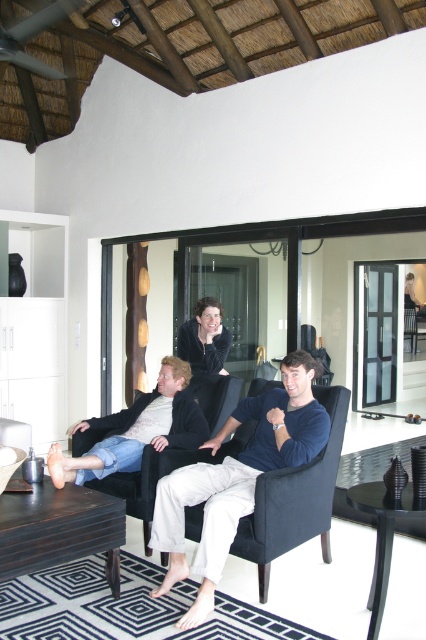
Does light beige cotton pants at center have a lesser width compared to dark blue fabric armchair at center?

Indeed, light beige cotton pants at center has a lesser width compared to dark blue fabric armchair at center.

From the picture: Between light beige cotton pants at center and dark blue fabric armchair at center, which one appears on the right side from the viewer's perspective?

Positioned to the right is light beige cotton pants at center.

The image size is (426, 640). What are the coordinates of `light beige cotton pants at center` in the screenshot? It's located at (236, 477).

I want to click on light beige cotton pants at center, so pyautogui.click(x=236, y=477).

This screenshot has width=426, height=640. What do you see at coordinates (137, 429) in the screenshot?
I see `denim jeans at left` at bounding box center [137, 429].

Between denim jeans at left and matte black jacket at center, which one is positioned higher?

matte black jacket at center is higher up.

You are a GUI agent. You are given a task and a screenshot of the screen. Output one action in this format:
    pyautogui.click(x=<x>, y=<y>)
    Task: Click on the denim jeans at left
    
    Given the screenshot: What is the action you would take?
    pyautogui.click(x=137, y=429)

Image resolution: width=426 pixels, height=640 pixels. What are the coordinates of `denim jeans at left` in the screenshot? It's located at (137, 429).

Measure the distance between denim jeans at left and camera.

denim jeans at left is 3.26 meters from camera.

At what (x,y) coordinates should I click in order to perform the action: click on denim jeans at left. Please return your answer as a coordinate pair (x, y). The width and height of the screenshot is (426, 640). Looking at the image, I should click on (137, 429).